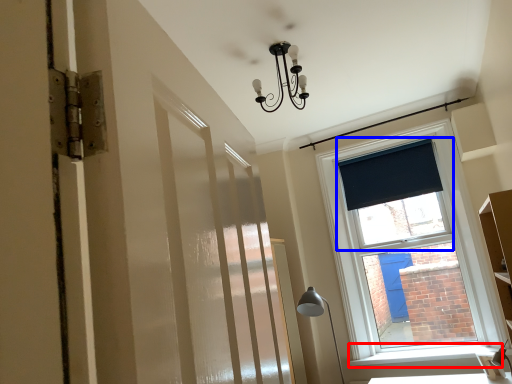
Question: Which point is closer to the camera, window sill (highlighted by a red box) or window screen (highlighted by a blue box)?

Choices:
 (A) window sill
 (B) window screen

Answer: (A)